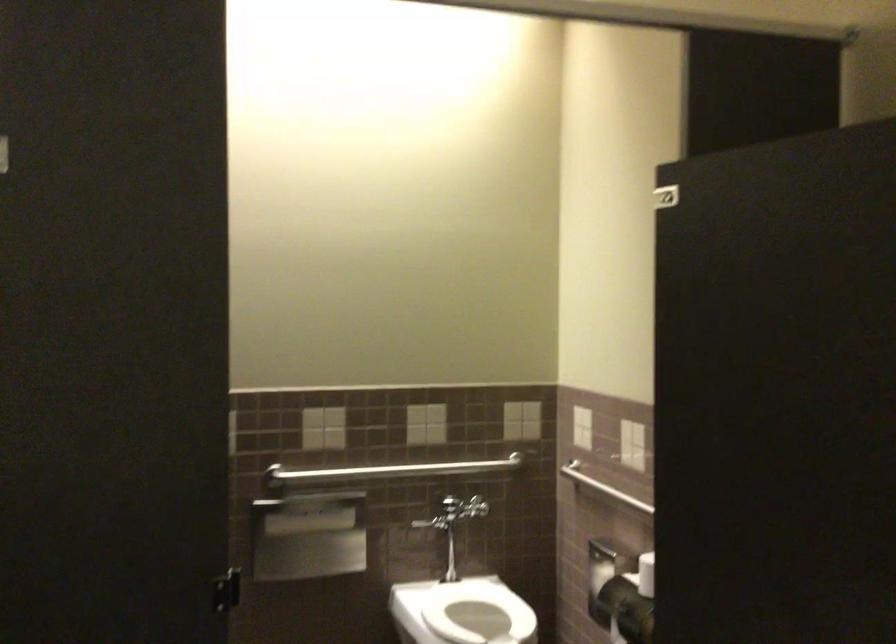
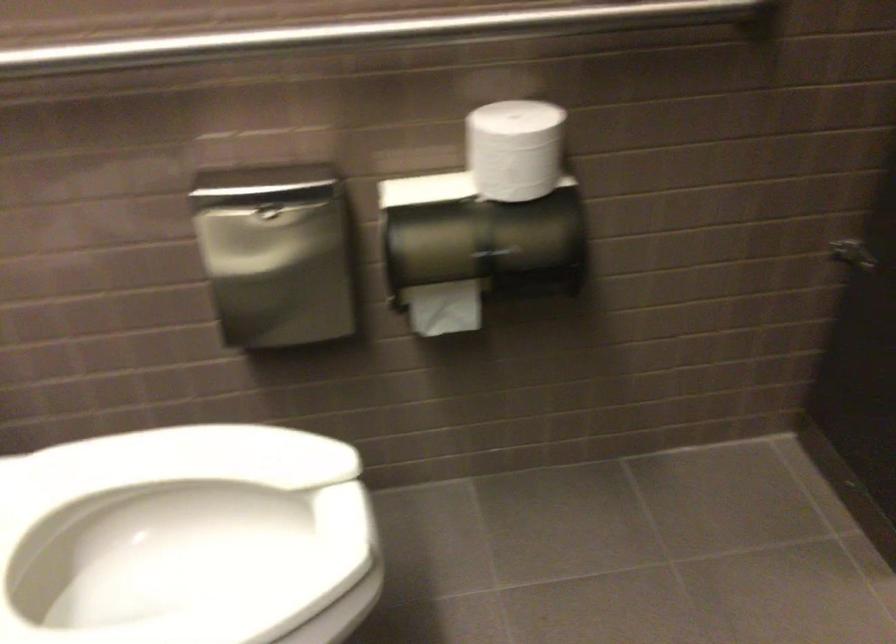
Where in the second image is the point corresponding to pixel 626 498 from the first image?

(368, 33)